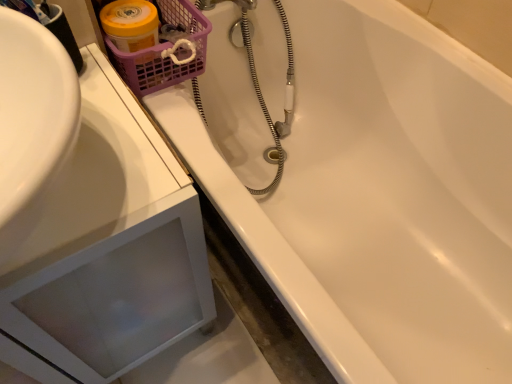
Question: Would you say purple plastic basket at upper left is part of white glossy sink at upper left's contents?

Choices:
 (A) no
 (B) yes

Answer: (A)

Question: Is white glossy sink at upper left bigger than purple plastic basket at upper left?

Choices:
 (A) yes
 (B) no

Answer: (A)

Question: Considering the relative sizes of white glossy sink at upper left and purple plastic basket at upper left in the image provided, is white glossy sink at upper left shorter than purple plastic basket at upper left?

Choices:
 (A) no
 (B) yes

Answer: (A)

Question: From the image's perspective, is white glossy sink at upper left on purple plastic basket at upper left?

Choices:
 (A) yes
 (B) no

Answer: (B)

Question: Can you confirm if white glossy sink at upper left is smaller than purple plastic basket at upper left?

Choices:
 (A) no
 (B) yes

Answer: (A)

Question: Is white glossy sink at upper left facing towards purple plastic basket at upper left?

Choices:
 (A) no
 (B) yes

Answer: (A)

Question: Can you confirm if purple plastic basket at upper left is thinner than white glossy sink at upper left?

Choices:
 (A) yes
 (B) no

Answer: (A)

Question: Is purple plastic basket at upper left located outside white glossy sink at upper left?

Choices:
 (A) no
 (B) yes

Answer: (B)

Question: Is white glossy sink at upper left located within purple plastic basket at upper left?

Choices:
 (A) no
 (B) yes

Answer: (A)

Question: Is the position of purple plastic basket at upper left less distant than that of white glossy sink at upper left?

Choices:
 (A) yes
 (B) no

Answer: (B)

Question: From the image's perspective, does purple plastic basket at upper left appear higher than white glossy sink at upper left?

Choices:
 (A) yes
 (B) no

Answer: (A)

Question: Is purple plastic basket at upper left to the right of white glossy sink at upper left from the viewer's perspective?

Choices:
 (A) no
 (B) yes

Answer: (B)

Question: From a real-world perspective, is purple plastic basket at upper left positioned above or below white glossy sink at upper left?

Choices:
 (A) above
 (B) below

Answer: (A)